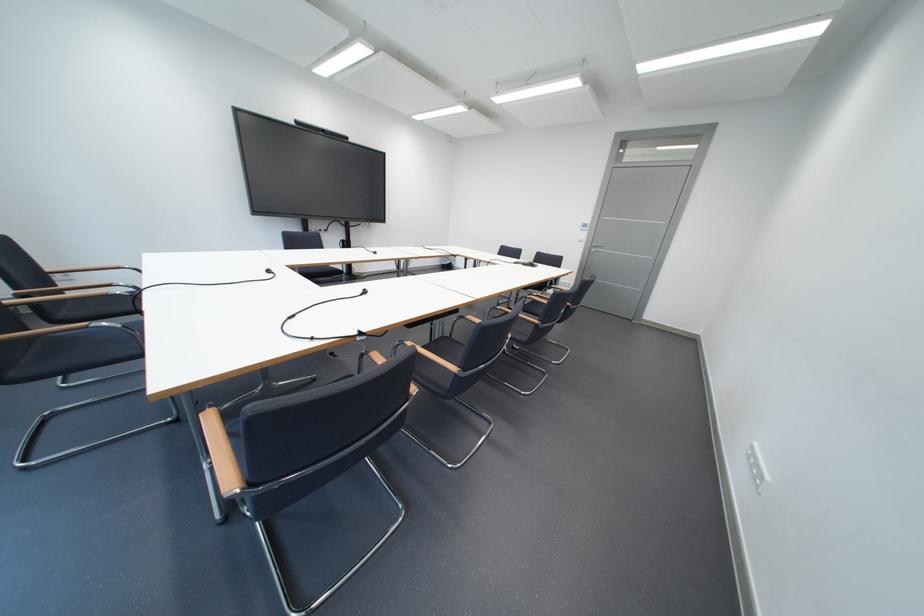
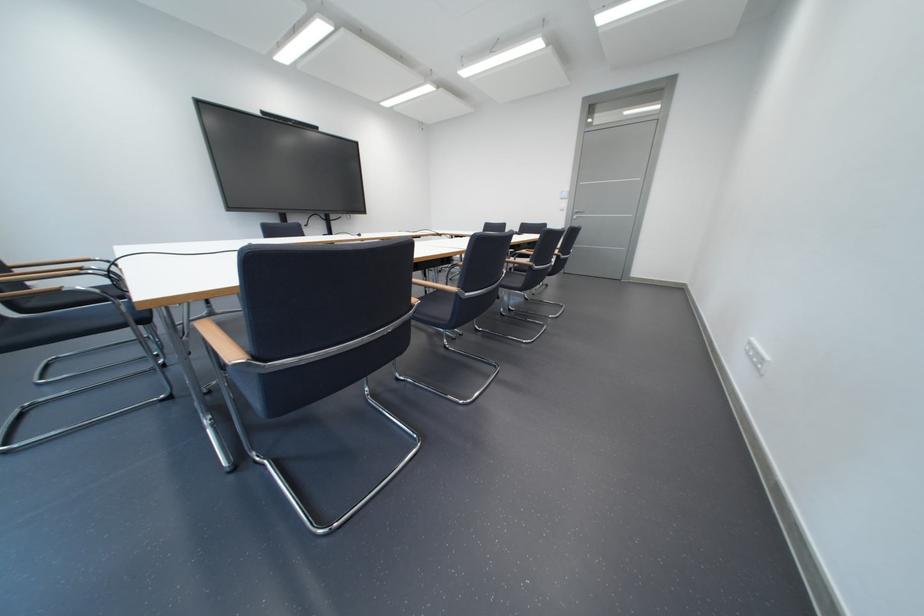
Question: In a continuous first-person perspective shot, in which direction is the camera moving?

Choices:
 (A) Left
 (B) Right
 (C) Forward
 (D) Backward

Answer: (A)